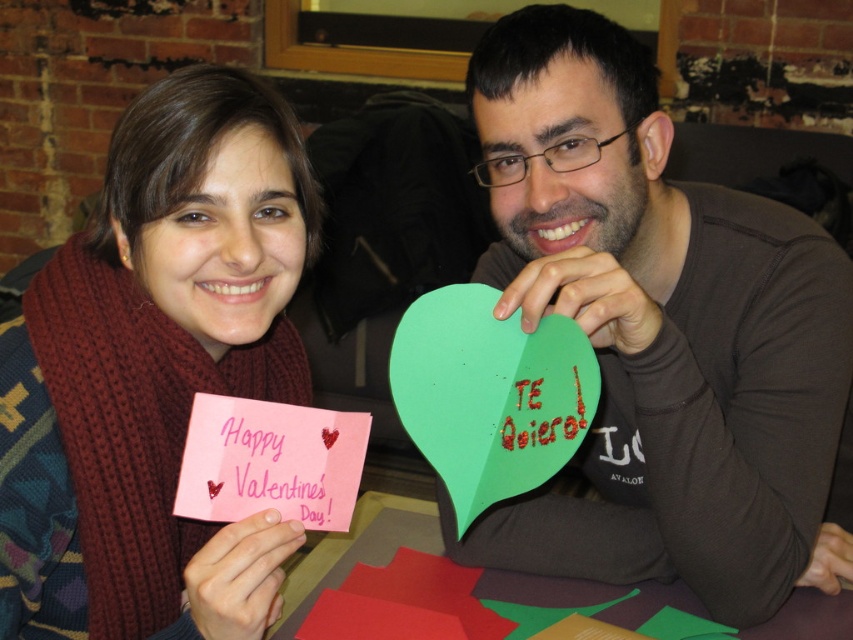
Question: Among these objects, which one is nearest to the camera?

Choices:
 (A) pink paper card at lower left
 (B) green paper heart at center
 (C) green paper heart at upper center

Answer: (A)

Question: Is green paper heart at center closer to the viewer compared to pink knitted scarf at left?

Choices:
 (A) yes
 (B) no

Answer: (B)

Question: Which object is positioned closest to the pink knitted scarf at left?

Choices:
 (A) smooth brown paper at center
 (B) green paper heart at center
 (C) pink paper card at lower left
 (D) green paper heart at upper center

Answer: (C)

Question: Can you confirm if pink paper card at lower left is positioned to the left of smooth brown paper at center?

Choices:
 (A) no
 (B) yes

Answer: (A)

Question: Does pink knitted scarf at left appear on the right side of green paper heart at upper center?

Choices:
 (A) no
 (B) yes

Answer: (A)

Question: Which object appears farthest from the camera in this image?

Choices:
 (A) smooth brown paper at center
 (B) green paper heart at upper center
 (C) green paper heart at center
 (D) pink knitted scarf at left

Answer: (A)